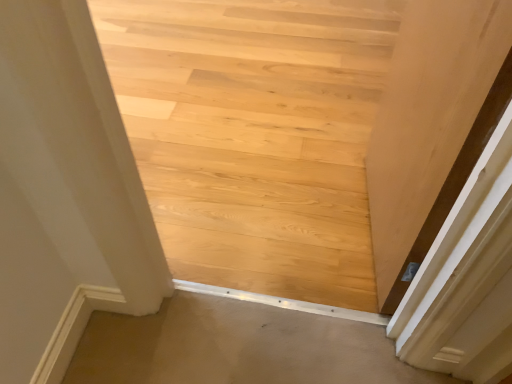
Identify the location of blank space situated above beige carpet at lower center (from a real-world perspective). (251, 348).